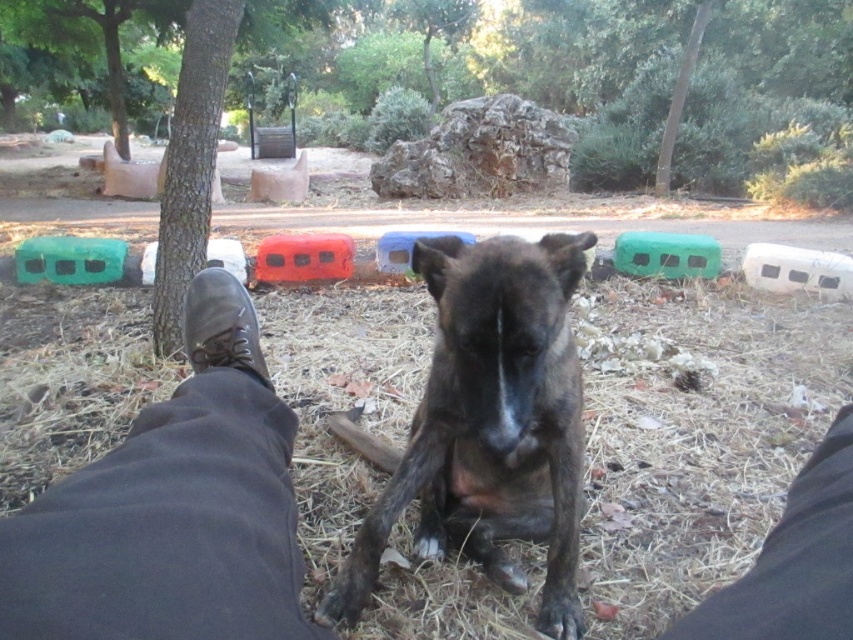
You are a photographer trying to capture a photo of the brown fur dog at center and the black fabric pants at lower right. Which object appears taller in the photo?

The brown fur dog at center appears much taller than the black fabric pants at lower right in the photo.